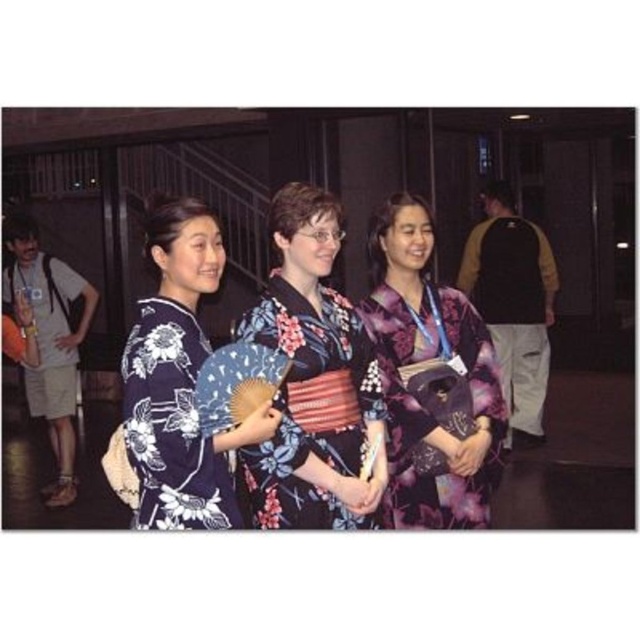
Which is in front, point (314, 461) or point (180, 349)?

Point (180, 349) is more forward.

Is floral silk kimono at center closer to camera compared to dark blue floral kimono at center?

No, floral silk kimono at center is further to the viewer.

Measure the distance between floral silk kimono at center and camera.

floral silk kimono at center and camera are 7.67 feet apart from each other.

Image resolution: width=640 pixels, height=640 pixels. I want to click on floral silk kimono at center, so tap(314, 380).

Is floral silk kimono at center further to camera compared to purple floral kimono at center?

No.

Image resolution: width=640 pixels, height=640 pixels. What do you see at coordinates (314, 380) in the screenshot?
I see `floral silk kimono at center` at bounding box center [314, 380].

Between point (257, 321) and point (483, 364), which one is positioned behind?

The point (483, 364) is behind.

Locate an element on the screen. floral silk kimono at center is located at coordinates (314, 380).

Is purple floral kimono at center taller than dark blue floral kimono at center?

Indeed, purple floral kimono at center has a greater height compared to dark blue floral kimono at center.

Find the location of a particular element. The width and height of the screenshot is (640, 640). purple floral kimono at center is located at coordinates (432, 378).